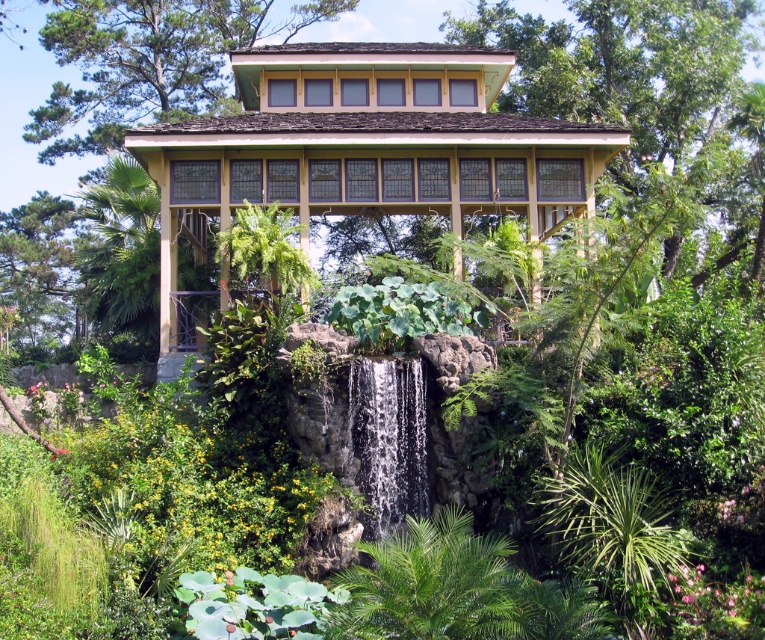
Question: Which point is farther to the camera?

Choices:
 (A) (171, 100)
 (B) (623, 22)
 (C) (466, 157)
 (D) (396, 371)

Answer: (A)

Question: Is green leafy tree at upper center to the left of clear water at center from the viewer's perspective?

Choices:
 (A) yes
 (B) no

Answer: (A)

Question: Is green leafy tree at upper center further to the viewer compared to clear water at center?

Choices:
 (A) no
 (B) yes

Answer: (B)

Question: Which point is closer to the camera taking this photo?

Choices:
 (A) (352, 374)
 (B) (41, 35)
 (C) (536, 44)
 (D) (417, 184)

Answer: (A)

Question: Which point is farther from the camera taking this photo?

Choices:
 (A) (252, 24)
 (B) (415, 417)
 (C) (327, 81)
 (D) (685, 20)

Answer: (A)

Question: Does green leafy tree at center have a lesser width compared to green leafy tree at upper center?

Choices:
 (A) no
 (B) yes

Answer: (B)